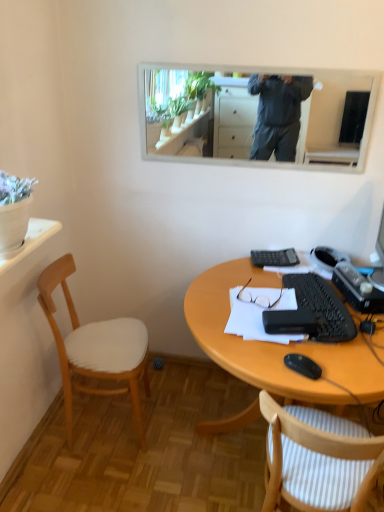
Where is `free spot above black plastic keyboard at center right (from a real-world perspective)`? The image size is (384, 512). free spot above black plastic keyboard at center right (from a real-world perspective) is located at coordinates (319, 288).